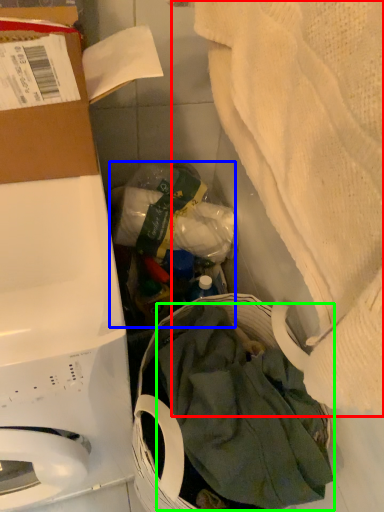
Question: Considering the real-world distances, which object is farthest from blanket (highlighted by a red box)? garbage (highlighted by a blue box) or clothing (highlighted by a green box)?

Choices:
 (A) garbage
 (B) clothing

Answer: (A)